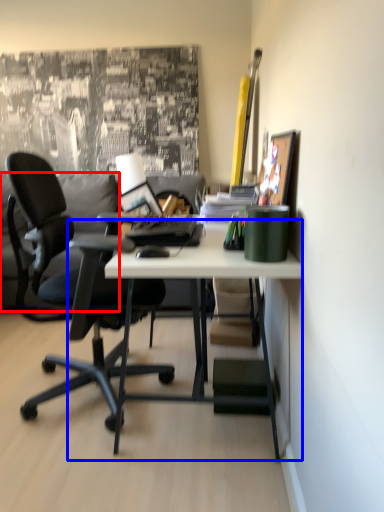
Question: Which of the following is the closest to the observer, pillow (highlighted by a red box) or desk (highlighted by a blue box)?

Choices:
 (A) pillow
 (B) desk

Answer: (B)